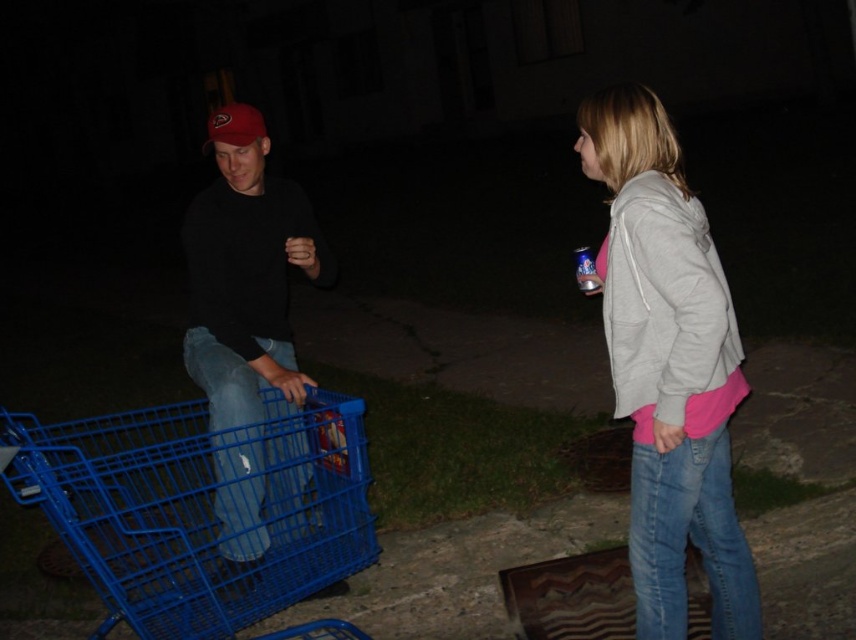
Can you confirm if blue plastic shopping cart at lower left is thinner than light gray hoodie at upper right?

No.

Does point (351, 497) come closer to viewer compared to point (623, 93)?

No, (351, 497) is further to viewer.

At what (x,y) coordinates should I click in order to perform the action: click on blue plastic shopping cart at lower left. Please return your answer as a coordinate pair (x, y). The image size is (856, 640). Looking at the image, I should click on (200, 508).

Who is taller, light gray hoodie at upper right or matte black shirt at center?

matte black shirt at center is taller.

Is light gray hoodie at upper right behind matte black shirt at center?

No, it is not.

Is point (718, 552) positioned before point (283, 180)?

That is True.

You are a GUI agent. You are given a task and a screenshot of the screen. Output one action in this format:
    pyautogui.click(x=<x>, y=<y>)
    Task: Click on the light gray hoodie at upper right
    The image size is (856, 640).
    Given the screenshot: What is the action you would take?
    pyautogui.click(x=669, y=365)

Is blue plastic shopping cart at lower left bigger than matte black shirt at center?

Indeed, blue plastic shopping cart at lower left has a larger size compared to matte black shirt at center.

Does blue plastic shopping cart at lower left appear over matte black shirt at center?

No.

Does point (177, 589) lie behind point (186, 225)?

No, it is not.

The height and width of the screenshot is (640, 856). Identify the location of blue plastic shopping cart at lower left. pyautogui.click(x=200, y=508).